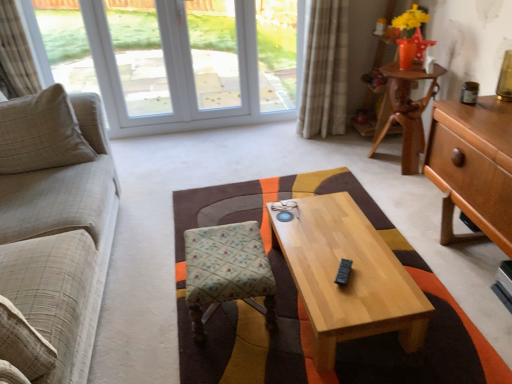
Measure the distance between point (201, 314) and camera.

Point (201, 314) and camera are 6.09 feet apart.

Measure the distance between beige plaid fabric couch at left and camera.

The depth of beige plaid fabric couch at left is 1.07 meters.

Describe the element at coordinates (409, 117) in the screenshot. The width and height of the screenshot is (512, 384). I see `wooden desk at upper right, which is the 1th desk in back-to-front order` at that location.

What do you see at coordinates (473, 167) in the screenshot?
I see `light brown wood desk at right, which appears as the first desk when viewed from the front` at bounding box center [473, 167].

Locate an element on the screen. The image size is (512, 384). plaid fabric curtain at upper right, the first curtain viewed from the right is located at coordinates click(x=325, y=70).

Which is correct: matte brown jar at upper right is inside patterned fabric cushion at center, or outside of it?

matte brown jar at upper right lies outside patterned fabric cushion at center.

In the scene shown: Is matte brown jar at upper right turned away from patterned fabric cushion at center?

No, matte brown jar at upper right is not facing away from patterned fabric cushion at center.

From a real-world perspective, does matte brown jar at upper right stand above patterned fabric cushion at center?

Yes.

Between matte brown jar at upper right and patterned fabric cushion at center, which one has larger size?

patterned fabric cushion at center is bigger.

Is point (383, 372) closer to camera compared to point (187, 235)?

Yes, point (383, 372) is closer to viewer.

Locate an element on the screen. The image size is (512, 384). chair behind the patterned fabric cushion at center is located at coordinates (227, 271).

Is patterned fabric cushion at center positioned with its back to patterned fabric stool at center?

No, patterned fabric cushion at center is not facing the opposite direction of patterned fabric stool at center.

From a real-world perspective, which object rests below the other?

patterned fabric cushion at center is physically lower.

Is point (81, 105) positioned in front of point (409, 77)?

Yes.

Image resolution: width=512 pixels, height=384 pixels. In order to click on the 2nd desk below the beige plaid fabric couch at left (from a real-world perspective) in this screenshot , I will do `click(409, 117)`.

Is beige plaid fabric couch at left looking in the opposite direction of wooden desk at upper right, which is the 1th desk in back-to-front order?

No, beige plaid fabric couch at left is not facing away from wooden desk at upper right, which is the 1th desk in back-to-front order.

Is beige plaid fabric couch at left next to wooden desk at upper right, which is the 1th desk in back-to-front order, and touching it?

No, beige plaid fabric couch at left is not making contact with wooden desk at upper right, which is the 1th desk in back-to-front order.

Considering the sizes of objects wooden desk at upper right, which ranks as the second desk in front-to-back order, and light brown wood desk at right, which appears as the first desk when viewed from the front, in the image provided, who is thinner, wooden desk at upper right, which ranks as the second desk in front-to-back order, or light brown wood desk at right, which appears as the first desk when viewed from the front,?

wooden desk at upper right, which ranks as the second desk in front-to-back order, is thinner.

I want to click on desk above the wooden desk at upper right, which is the 1th desk in back-to-front order (from a real-world perspective), so click(x=473, y=167).

Is wooden desk at upper right, which is the 1th desk in back-to-front order, far from light brown wood desk at right, which is the second desk in back-to-front order?

No, wooden desk at upper right, which is the 1th desk in back-to-front order, is not far from light brown wood desk at right, which is the second desk in back-to-front order.

From a real-world perspective, which object stands above the other?

light brown wood desk at right, which is the second desk in back-to-front order.

Does patterned fabric stool at center have a smaller size compared to light brown wood desk at right, which is the second desk in back-to-front order?

Yes.

Image resolution: width=512 pixels, height=384 pixels. I want to click on chair that is below the light brown wood desk at right, which is the second desk in back-to-front order (from the image's perspective), so click(227, 271).

Between patterned fabric stool at center and light brown wood desk at right, which appears as the first desk when viewed from the front, which one has less height?

patterned fabric stool at center is shorter.

This screenshot has width=512, height=384. Identify the location of curtain to the left of white plastic window at upper left. (15, 55).

Which of these two, white plastic window at upper left or beige textured curtain at left, positioned as the 1th curtain in left-to-right order, is wider?

beige textured curtain at left, positioned as the 1th curtain in left-to-right order, is wider.

From a real-world perspective, who is located lower, white plastic window at upper left or beige textured curtain at left, the 2th curtain positioned from the right?

white plastic window at upper left, from a real-world perspective.

Based on their positions, is wooden desk at upper right, which is the 1th desk in back-to-front order, located to the left or right of beige textured curtain at left, the 2th curtain positioned from the right?

Clearly, wooden desk at upper right, which is the 1th desk in back-to-front order, is on the right of beige textured curtain at left, the 2th curtain positioned from the right, in the image.

Is beige textured curtain at left, the 2th curtain positioned from the right, at the back of wooden desk at upper right, which ranks as the second desk in front-to-back order?

No, wooden desk at upper right, which ranks as the second desk in front-to-back order, is not facing the opposite direction of beige textured curtain at left, the 2th curtain positioned from the right.

Are wooden desk at upper right, which ranks as the second desk in front-to-back order, and beige textured curtain at left, the 2th curtain positioned from the right, making contact?

No, wooden desk at upper right, which ranks as the second desk in front-to-back order, is not touching beige textured curtain at left, the 2th curtain positioned from the right.

Consider the image. Does wooden desk at upper right, which ranks as the second desk in front-to-back order, have a lesser width compared to beige textured curtain at left, the 2th curtain positioned from the right?

No, wooden desk at upper right, which ranks as the second desk in front-to-back order, is not thinner than beige textured curtain at left, the 2th curtain positioned from the right.

Where is `blanket below the matte brown jar at upper right (from the image's perspective)`? blanket below the matte brown jar at upper right (from the image's perspective) is located at coordinates (305, 311).

Identify the location of chair that is on the left side of patterned fabric cushion at center. (227, 271).

Estimate the real-world distances between objects in this image. Which object is closer to beige textured curtain at left, the 2th curtain positioned from the right, patterned fabric stool at center or patterned fabric cushion at center?

patterned fabric cushion at center is closer to beige textured curtain at left, the 2th curtain positioned from the right.

From the picture: Estimate the real-world distances between objects in this image. Which object is further from light brown wood desk at right, which is the second desk in back-to-front order, light wood/texture coffee table at center or wooden desk at upper right, which ranks as the second desk in front-to-back order?

The object further to light brown wood desk at right, which is the second desk in back-to-front order, is wooden desk at upper right, which ranks as the second desk in front-to-back order.

When comparing their distances from beige fabric pillow at left, does light brown wood desk at right, which appears as the first desk when viewed from the front, or patterned fabric stool at center seem further?

A: light brown wood desk at right, which appears as the first desk when viewed from the front, is positioned further to the anchor beige fabric pillow at left.

Estimate the real-world distances between objects in this image. Which object is closer to wooden desk at upper right, which is the 1th desk in back-to-front order, matte brown jar at upper right or plaid fabric curtain at upper right, the first curtain viewed from the right?

Among the two, plaid fabric curtain at upper right, the first curtain viewed from the right, is located nearer to wooden desk at upper right, which is the 1th desk in back-to-front order.

Looking at the image, which one is located further to beige fabric pillow at left, wooden desk at upper right, which ranks as the second desk in front-to-back order, or plaid fabric curtain at upper right, the 2th curtain in the left-to-right sequence?

Among the two, wooden desk at upper right, which ranks as the second desk in front-to-back order, is located further to beige fabric pillow at left.

From the image, which object appears to be nearer to beige textured curtain at left, positioned as the 1th curtain in left-to-right order, light wood/texture coffee table at center or beige plaid fabric couch at left?

beige plaid fabric couch at left is closer to beige textured curtain at left, positioned as the 1th curtain in left-to-right order.

Which object lies nearer to the anchor point plaid fabric curtain at upper right, the first curtain viewed from the right, light wood/texture coffee table at center or beige plaid fabric couch at left?

light wood/texture coffee table at center is positioned closer to the anchor plaid fabric curtain at upper right, the first curtain viewed from the right.

When comparing their distances from beige textured curtain at left, positioned as the 1th curtain in left-to-right order, does wooden desk at upper right, which is the 1th desk in back-to-front order, or beige plaid fabric couch at left seem further?

wooden desk at upper right, which is the 1th desk in back-to-front order, lies further to beige textured curtain at left, positioned as the 1th curtain in left-to-right order, than the other object.

At what (x,y) coordinates should I click in order to perform the action: click on chair between beige fabric pillow at left and light brown wood desk at right, which appears as the first desk when viewed from the front, from left to right. Please return your answer as a coordinate pair (x, y). Looking at the image, I should click on (227, 271).

At what (x,y) coordinates should I click in order to perform the action: click on chair located between white plastic window at upper left and wooden desk at upper right, which ranks as the second desk in front-to-back order, in the left-right direction. Please return your answer as a coordinate pair (x, y). Image resolution: width=512 pixels, height=384 pixels. Looking at the image, I should click on (227, 271).

Identify the location of window between beige textured curtain at left, positioned as the 1th curtain in left-to-right order, and light wood/texture coffee table at center from left to right. This screenshot has height=384, width=512. (177, 74).

Identify the location of blanket between white plastic window at upper left and matte brown jar at upper right from left to right. (305, 311).